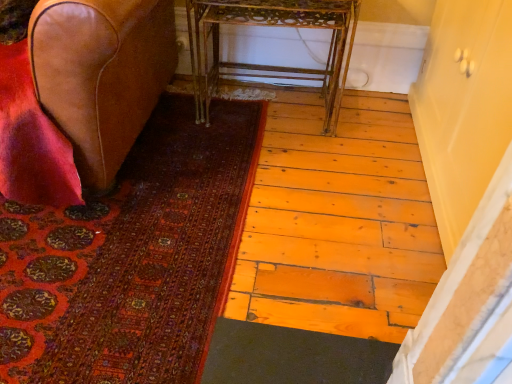
Question: From the image's perspective, is matte cream cabinet at right located above or below metallic gold table at center?

Choices:
 (A) below
 (B) above

Answer: (A)

Question: Based on their sizes in the image, would you say matte cream cabinet at right is bigger or smaller than metallic gold table at center?

Choices:
 (A) small
 (B) big

Answer: (B)

Question: Which of these objects is positioned closest to the metallic gold table at center?

Choices:
 (A) carpeted mat at lower left
 (B) leather at left
 (C) matte cream cabinet at right

Answer: (B)

Question: Which is farther from the matte cream cabinet at right?

Choices:
 (A) leather at left
 (B) metallic gold table at center
 (C) carpeted mat at lower left

Answer: (A)